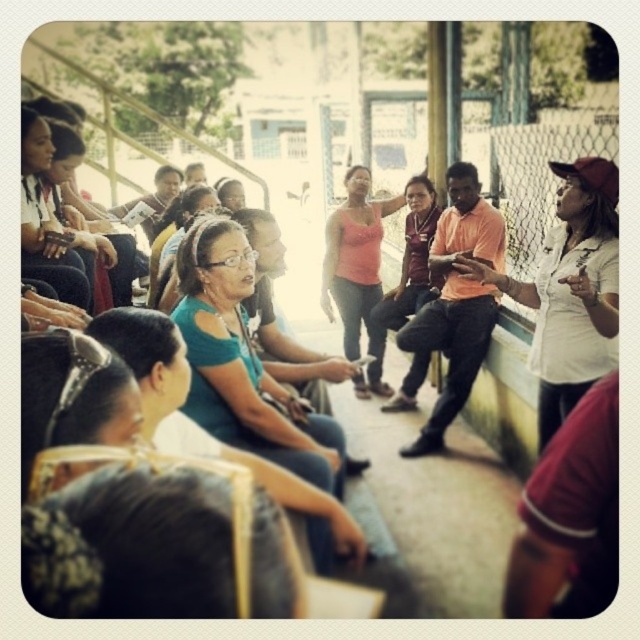
Question: Which point appears closest to the camera in this image?

Choices:
 (A) (577, 273)
 (B) (380, 342)
 (C) (58, 227)
 (D) (381, 300)

Answer: (A)

Question: Which object is positioned farthest from the matte black laptop at left?

Choices:
 (A) pink matte tank top at center
 (B) matte pink shirt at center
 (C) teal fabric shirt at center
 (D) white matte shirt at right

Answer: (B)

Question: Which of the following is the farthest from the observer?

Choices:
 (A) matte black laptop at left
 (B) pink matte tank top at center

Answer: (B)

Question: Can you confirm if teal fabric shirt at center is positioned above matte black laptop at left?

Choices:
 (A) yes
 (B) no

Answer: (B)

Question: Can you confirm if pink matte tank top at center is thinner than matte black laptop at left?

Choices:
 (A) no
 (B) yes

Answer: (A)

Question: Is teal fabric shirt at center bigger than pink matte tank top at center?

Choices:
 (A) no
 (B) yes

Answer: (B)